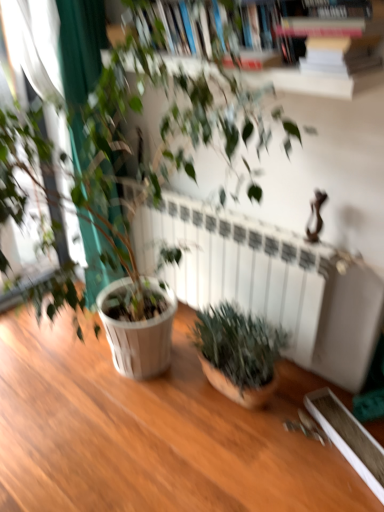
Question: Is white matte radiator at center at the back of green matte plant at lower right, the second houseplant from the top?

Choices:
 (A) yes
 (B) no

Answer: (A)

Question: Is green matte plant at lower right, the second houseplant from the top, far away from white matte radiator at center?

Choices:
 (A) no
 (B) yes

Answer: (A)

Question: From a real-world perspective, is green matte plant at lower right, positioned as the 1th houseplant in bottom-to-top order, over white matte radiator at center?

Choices:
 (A) yes
 (B) no

Answer: (B)

Question: Does green matte plant at lower right, positioned as the 1th houseplant in bottom-to-top order, appear on the right side of white matte radiator at center?

Choices:
 (A) no
 (B) yes

Answer: (B)

Question: From the image's perspective, would you say green matte plant at lower right, the second houseplant from the top, is shown under white matte radiator at center?

Choices:
 (A) yes
 (B) no

Answer: (A)

Question: Is green matte plant at lower right, the second houseplant from the top, further to camera compared to white matte radiator at center?

Choices:
 (A) no
 (B) yes

Answer: (A)

Question: Could you tell me if green matte plant at lower right, positioned as the 1th houseplant in bottom-to-top order, is facing wooden bookcase at upper center?

Choices:
 (A) yes
 (B) no

Answer: (B)

Question: Can you confirm if green matte plant at lower right, the second houseplant from the top, is wider than wooden bookcase at upper center?

Choices:
 (A) no
 (B) yes

Answer: (B)

Question: Can you confirm if green matte plant at lower right, the second houseplant from the top, is positioned to the right of wooden bookcase at upper center?

Choices:
 (A) no
 (B) yes

Answer: (B)

Question: Is green matte plant at lower right, the second houseplant from the top, further to camera compared to wooden bookcase at upper center?

Choices:
 (A) no
 (B) yes

Answer: (B)

Question: Is the depth of green matte plant at lower right, the second houseplant from the top, less than that of wooden bookcase at upper center?

Choices:
 (A) yes
 (B) no

Answer: (B)

Question: Is green matte plant at lower right, positioned as the 1th houseplant in bottom-to-top order, completely or partially outside of wooden bookcase at upper center?

Choices:
 (A) no
 (B) yes

Answer: (B)

Question: Are white matte radiator at center and green matte plant at center, which is the 1th houseplant in top-to-bottom order, far apart?

Choices:
 (A) no
 (B) yes

Answer: (A)